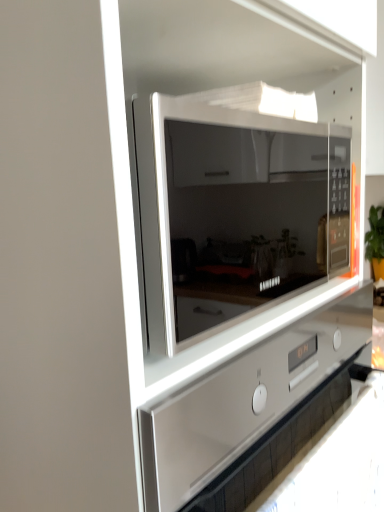
Question: Is satin white oven at center in front of or behind sleek glass microwave at center in the image?

Choices:
 (A) behind
 (B) front

Answer: (B)

Question: Does point (167, 482) appear closer or farther from the camera than point (193, 219)?

Choices:
 (A) closer
 (B) farther

Answer: (A)

Question: From the image's perspective, is satin white oven at center above or below sleek glass microwave at center?

Choices:
 (A) below
 (B) above

Answer: (A)

Question: From a real-world perspective, is sleek glass microwave at center physically located above or below satin white oven at center?

Choices:
 (A) above
 (B) below

Answer: (A)

Question: Is sleek glass microwave at center wider or thinner than satin white oven at center?

Choices:
 (A) wide
 (B) thin

Answer: (B)

Question: Is point (339, 142) positioned closer to the camera than point (251, 424)?

Choices:
 (A) farther
 (B) closer

Answer: (A)

Question: Is sleek glass microwave at center to the left or to the right of satin white oven at center in the image?

Choices:
 (A) left
 (B) right

Answer: (B)